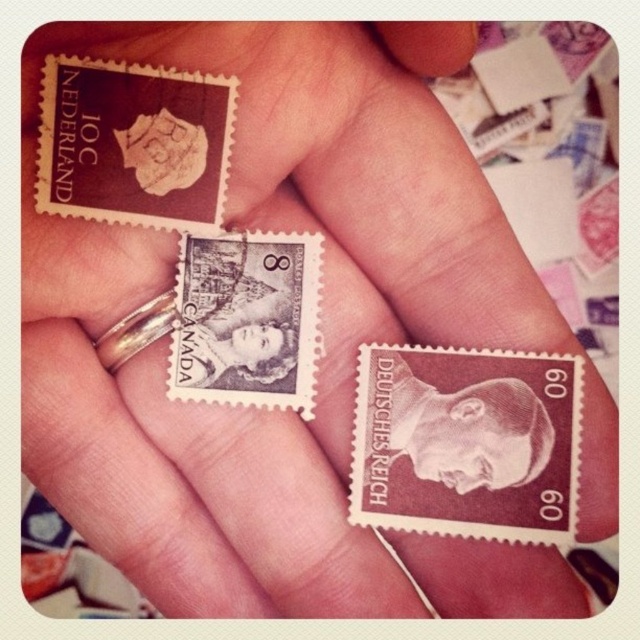
Question: Considering the relative positions of brown paper stamp at upper left and black paper stamp at center in the image provided, where is brown paper stamp at upper left located with respect to black paper stamp at center?

Choices:
 (A) below
 (B) above

Answer: (B)

Question: Does brown paper stamp at center appear under black paper stamp at center?

Choices:
 (A) yes
 (B) no

Answer: (A)

Question: Which point is farther to the camera?

Choices:
 (A) (422, 460)
 (B) (102, 186)
 (C) (525, 472)
 (D) (252, 285)

Answer: (D)

Question: Is brown paper stamp at upper left wider than black paper stamp at center?

Choices:
 (A) no
 (B) yes

Answer: (B)

Question: Estimate the real-world distances between objects in this image. Which object is farther from the black paper stamp at center?

Choices:
 (A) brown paper stamp at upper left
 (B) smooth brown portrait at center
 (C) brown paper stamp at center

Answer: (B)

Question: Estimate the real-world distances between objects in this image. Which object is closer to the brown paper stamp at center?

Choices:
 (A) black paper stamp at center
 (B) brown paper stamp at upper left
 (C) smooth brown portrait at center

Answer: (C)